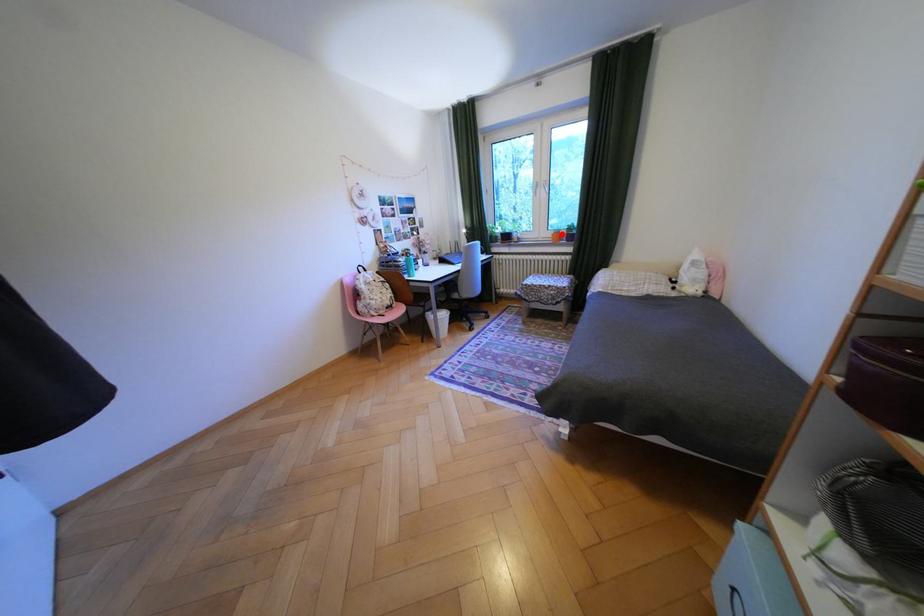
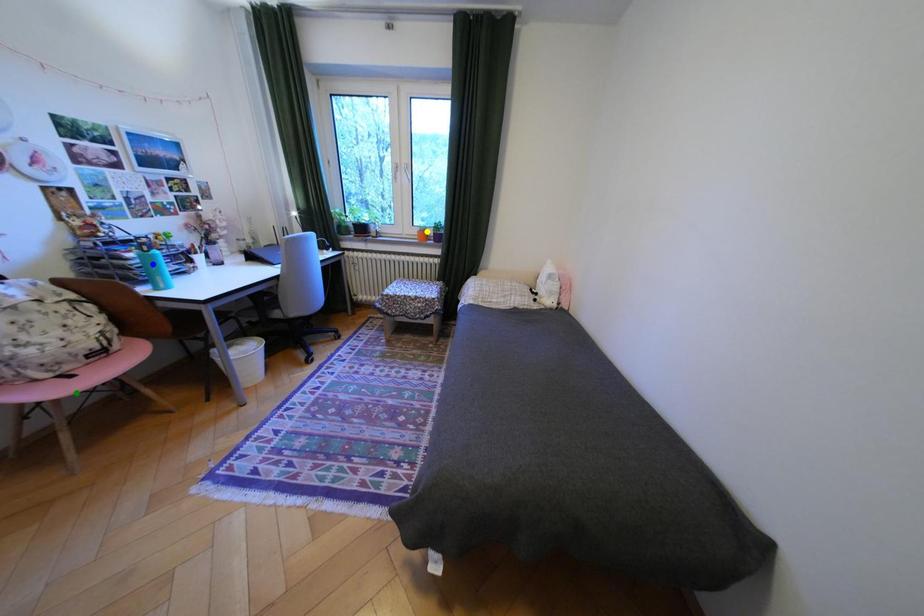
Question: I am providing you with two images of the same scene from different viewpoints. A red point is marked on the first image. You are given multiple points on the second image. In image 2, which mark is for the same physical point as the one in image 1?

Choices:
 (A) blue point
 (B) green point
 (C) yellow point

Answer: (C)